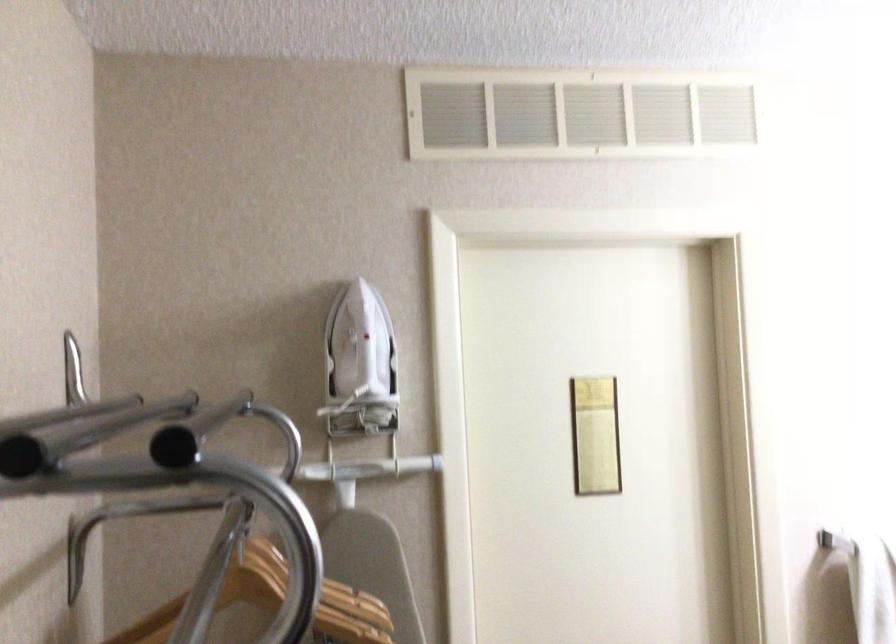
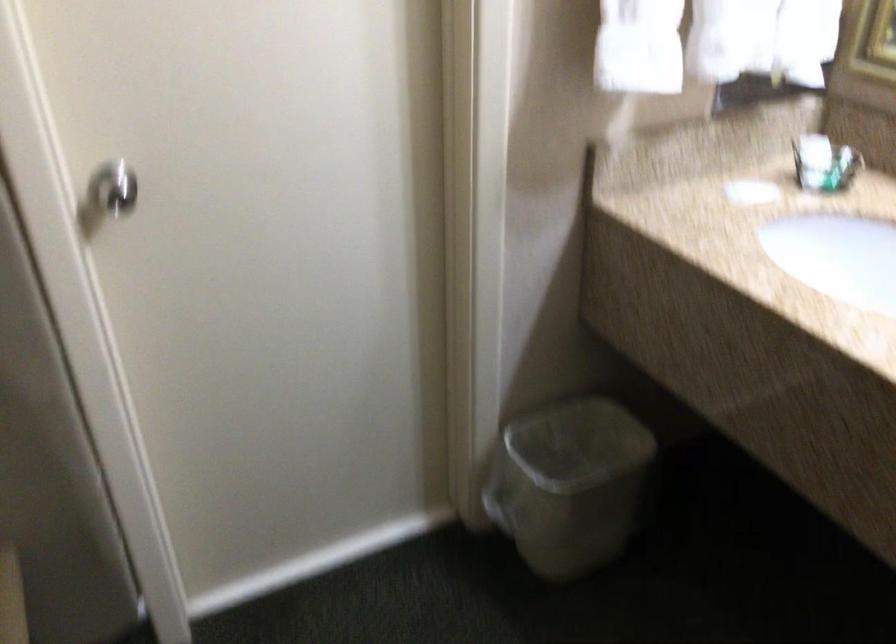
How did the camera likely rotate?

The camera's rotation is toward right-down.